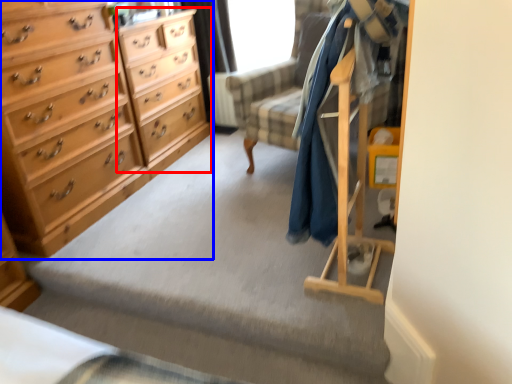
Question: Which object is further to the camera taking this photo, file cabinet (highlighted by a red box) or chest of drawers (highlighted by a blue box)?

Choices:
 (A) file cabinet
 (B) chest of drawers

Answer: (A)